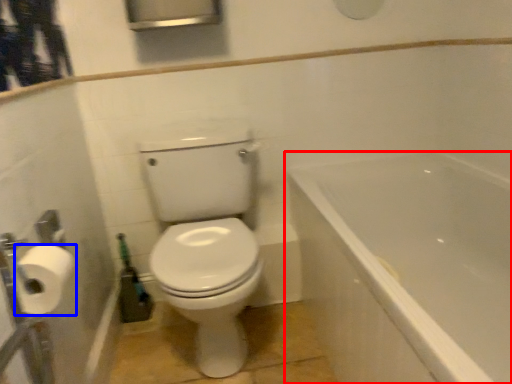
Question: Which of the following is the closest to the observer, bathtub (highlighted by a red box) or toilet paper (highlighted by a blue box)?

Choices:
 (A) bathtub
 (B) toilet paper

Answer: (A)